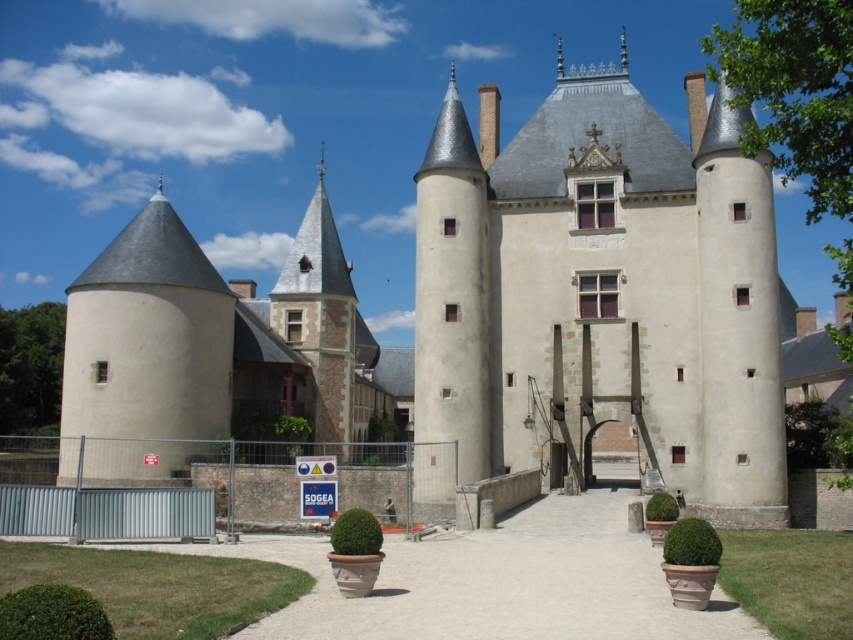
Does smooth beige stone tower at center have a greater height compared to smooth beige tower at left?

Correct, smooth beige stone tower at center is much taller as smooth beige tower at left.

Which is behind, point (677, 372) or point (85, 346)?

The point (85, 346) is more distant.

Find the location of a particular element. smooth beige stone tower at center is located at coordinates (602, 292).